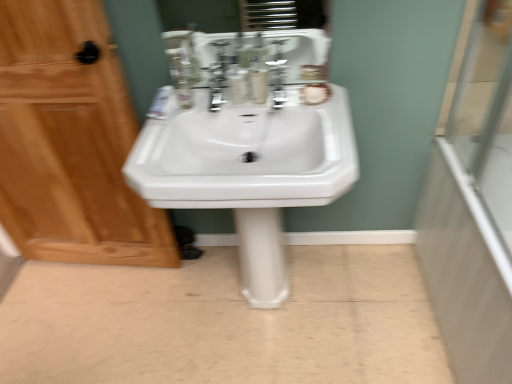
The width and height of the screenshot is (512, 384). Identify the location of vacant area that lies to the right of wooden cabinet at left. (190, 298).